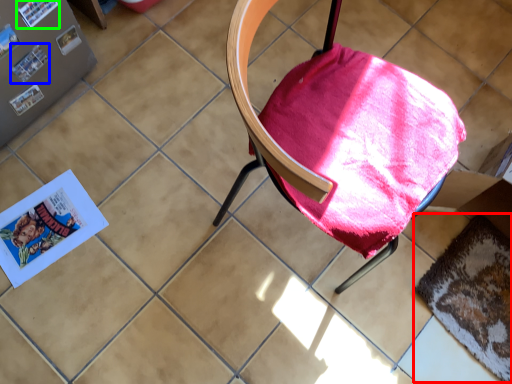
Question: Estimate the real-world distances between objects in this image. Which object is closer to mat (highlighted by a red box), paperback book (highlighted by a blue box) or paperback book (highlighted by a green box)?

Choices:
 (A) paperback book
 (B) paperback book

Answer: (A)